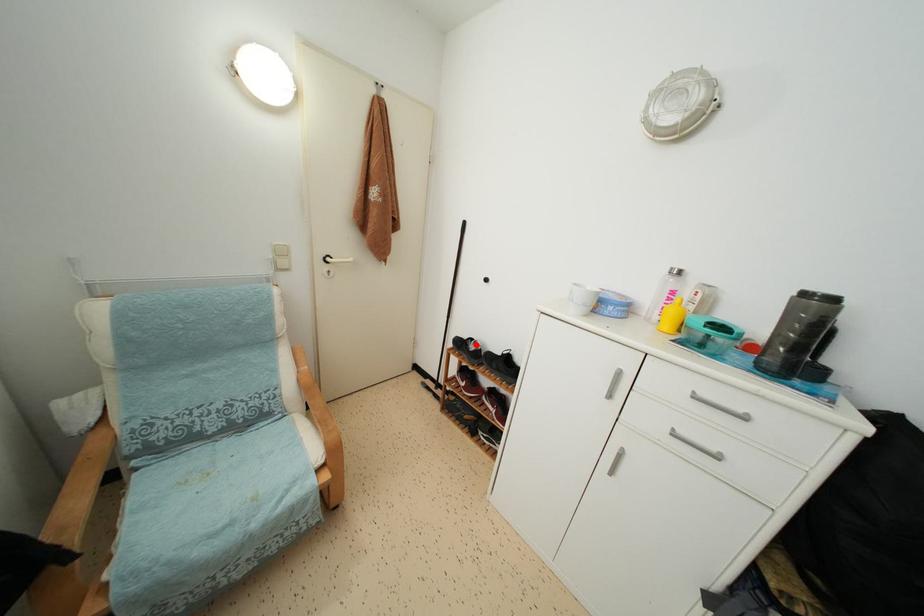
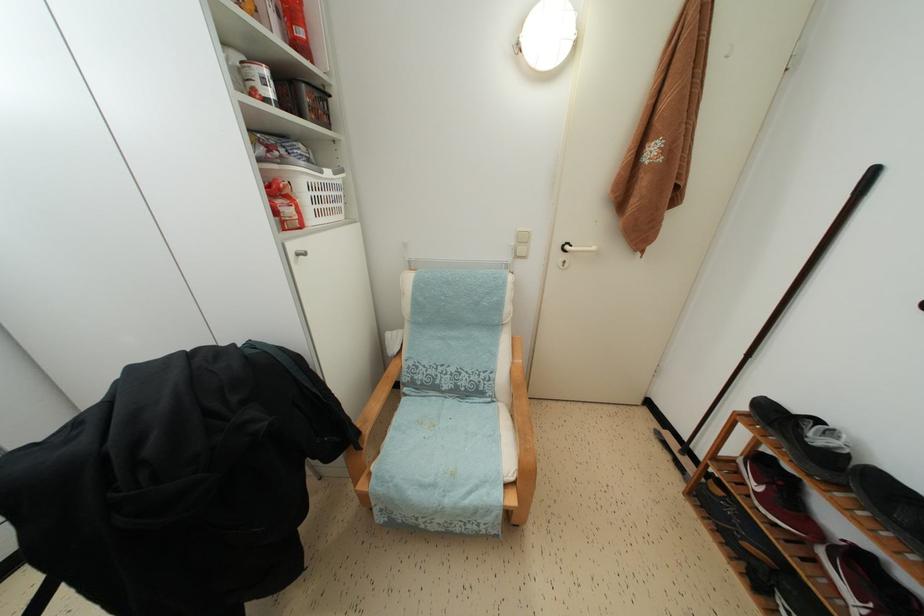
Find the pixel in the second image that matches the highlighted location in the first image.

(821, 427)